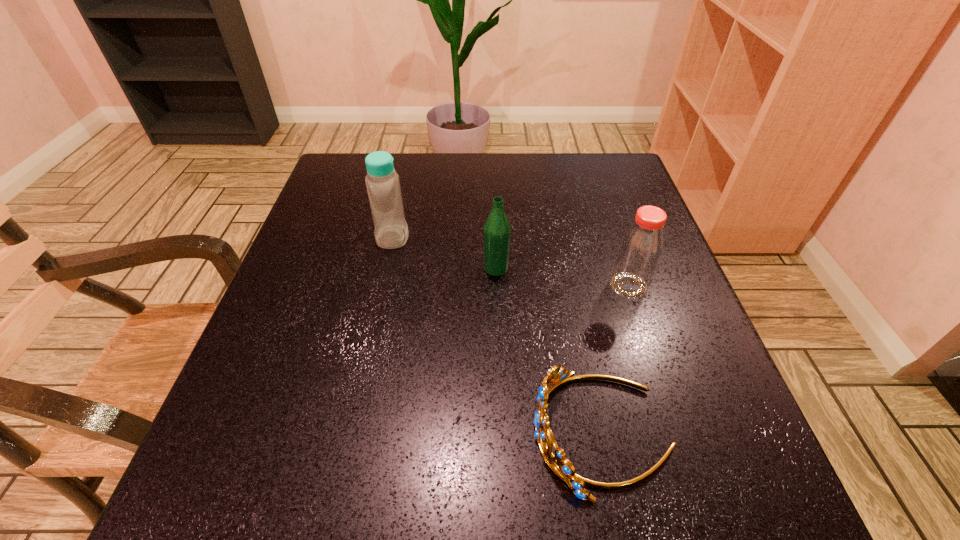
Identify the location of blank space at the near left corner of the desktop. Image resolution: width=960 pixels, height=540 pixels. (212, 462).

The image size is (960, 540). I want to click on free space between the rightmost bottle and the farthest object, so click(511, 261).

What are the coordinates of `free space between the nearest object and the rightmost bottle` in the screenshot? It's located at (614, 359).

Identify the location of free space between the farthest bottle and the second object from left to right. (444, 253).

Identify the location of unoccupied area between the rightmost bottle and the leftmost object. (511, 261).

Locate an element on the screen. The width and height of the screenshot is (960, 540). free point between the farthest bottle and the rightmost bottle is located at coordinates (511, 261).

What are the coordinates of `free area in between the farthest object and the rightmost bottle` in the screenshot? It's located at (511, 261).

The width and height of the screenshot is (960, 540). Identify the location of unoccupied position between the tiara and the rightmost bottle. (614, 359).

Where is `free spot between the second bottle from right to left and the farthest bottle`? free spot between the second bottle from right to left and the farthest bottle is located at coordinates (444, 253).

This screenshot has width=960, height=540. Find the location of `unoccupied area between the second bottle from right to left and the tiara`. unoccupied area between the second bottle from right to left and the tiara is located at coordinates (548, 350).